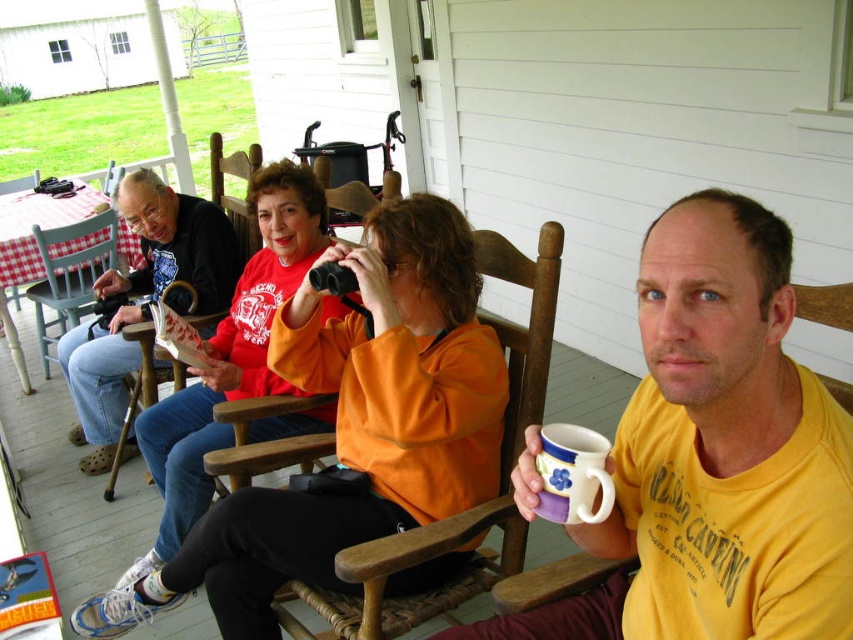
Is yellow matte t-shirt at center further to the viewer compared to matte black jacket at left?

No, yellow matte t-shirt at center is closer to the viewer.

Which of these two, yellow matte t-shirt at center or matte black jacket at left, stands shorter?

yellow matte t-shirt at center

Describe the element at coordinates (715, 456) in the screenshot. I see `yellow matte t-shirt at center` at that location.

Find the location of a particular element. The height and width of the screenshot is (640, 853). yellow matte t-shirt at center is located at coordinates (715, 456).

Measure the distance between point (207, 301) and camera.

2.84 meters

Is point (123, 406) positioned before point (68, 230)?

Yes, it is in front of point (68, 230).

At what (x,y) coordinates should I click in order to perform the action: click on matte black jacket at left. Please return your answer as a coordinate pair (x, y). This screenshot has height=640, width=853. Looking at the image, I should click on (173, 244).

How far apart are matte black jacket at left and wooden chair at left?

A distance of 7.34 inches exists between matte black jacket at left and wooden chair at left.

Which is more to the left, matte black jacket at left or wooden chair at left?

matte black jacket at left

Where is `matte black jacket at left`? matte black jacket at left is located at coordinates (173, 244).

Identify the location of matte black jacket at left. (173, 244).